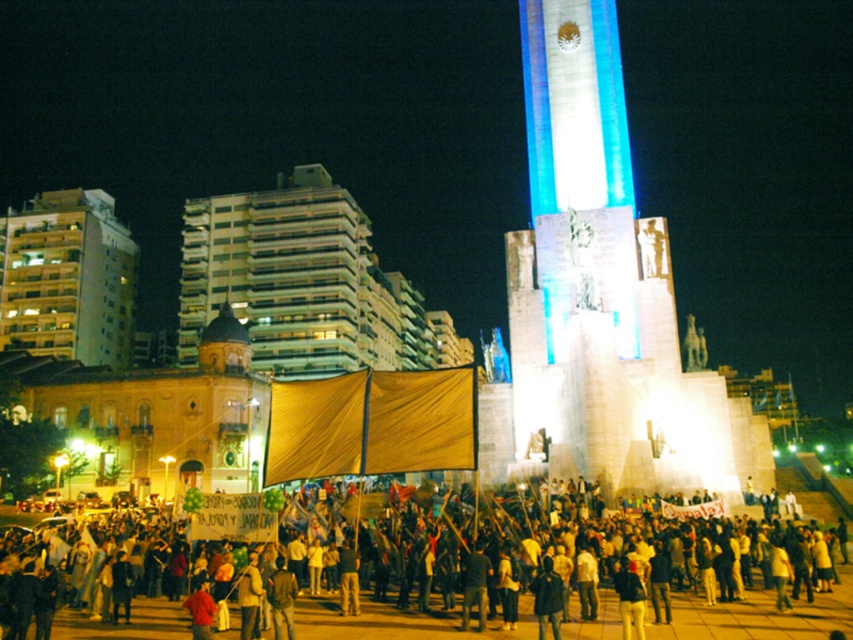
Image resolution: width=853 pixels, height=640 pixels. Describe the element at coordinates (601, 298) in the screenshot. I see `white stone monument at center` at that location.

Does point (634, 291) come behind point (47, 344)?

No, (634, 291) is in front of (47, 344).

Is point (595, 365) positioned behind point (45, 253)?

No, it is in front of (45, 253).

The height and width of the screenshot is (640, 853). I want to click on white stone monument at center, so click(601, 298).

Can you confirm if dark clothing at lower center is bigger than yellowish concrete building at left?

Actually, dark clothing at lower center might be smaller than yellowish concrete building at left.

Does dark clothing at lower center have a lesser width compared to yellowish concrete building at left?

Incorrect, dark clothing at lower center's width is not less than yellowish concrete building at left's.

Locate an element on the screen. dark clothing at lower center is located at coordinates (428, 573).

Consider the image. Can you confirm if dark clothing at lower center is thinner than white stone monument at center?

No.

Is dark clothing at lower center shorter than white stone monument at center?

Yes, dark clothing at lower center is shorter than white stone monument at center.

Between point (328, 554) and point (497, 385), which one is positioned behind?

The point (497, 385) is more distant.

Locate an element on the screen. The image size is (853, 640). dark clothing at lower center is located at coordinates (428, 573).